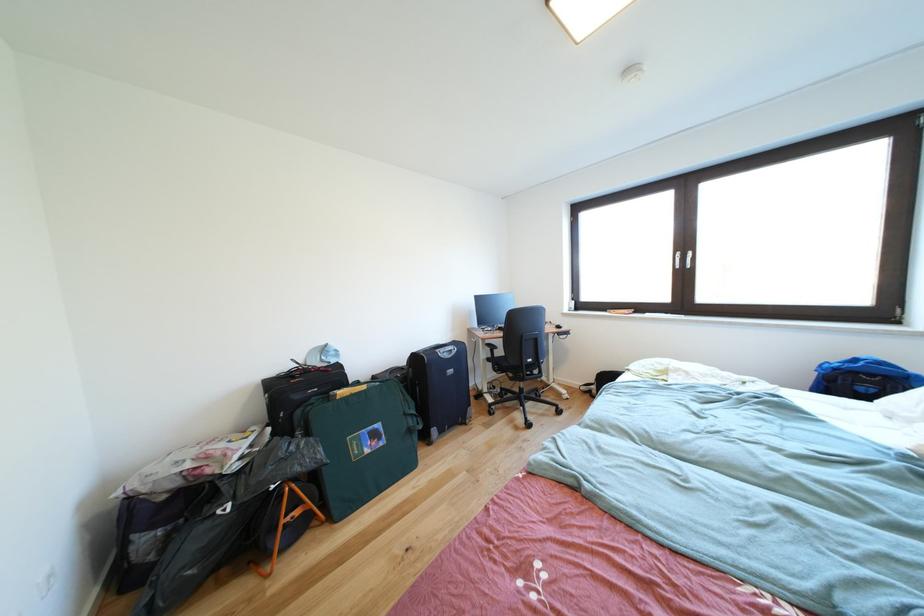
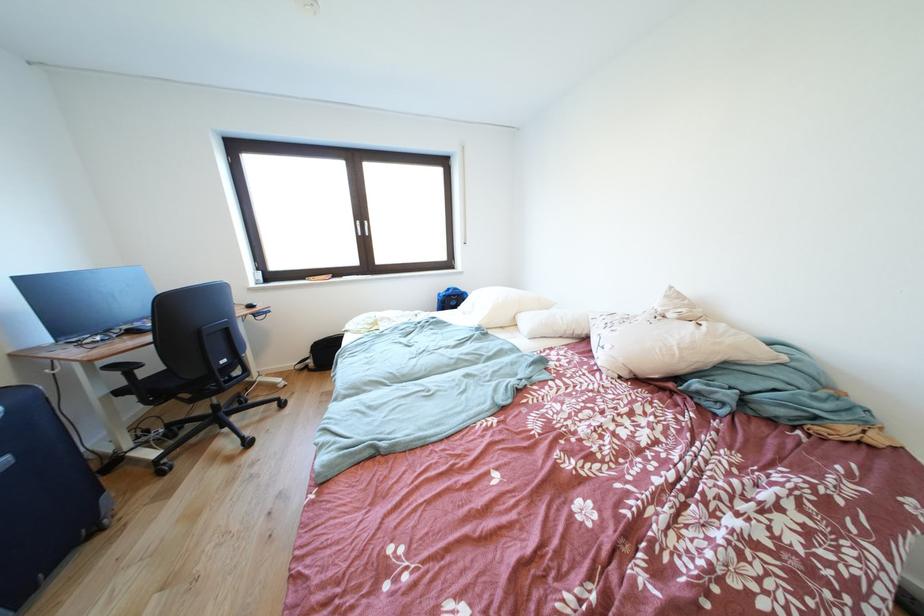
Question: The camera is either moving clockwise (left) or counter-clockwise (right) around the object. The first image is from the beginning of the video and the second image is from the end. Is the camera moving left or right when shooting the video?

Choices:
 (A) Left
 (B) Right

Answer: (A)